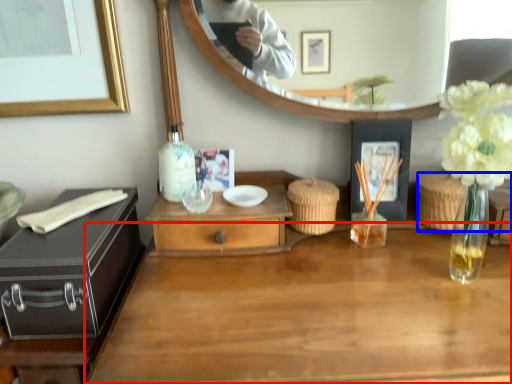
Question: Which of the following is the closest to the observer, desk (highlighted by a red box) or picnic basket (highlighted by a blue box)?

Choices:
 (A) desk
 (B) picnic basket

Answer: (A)